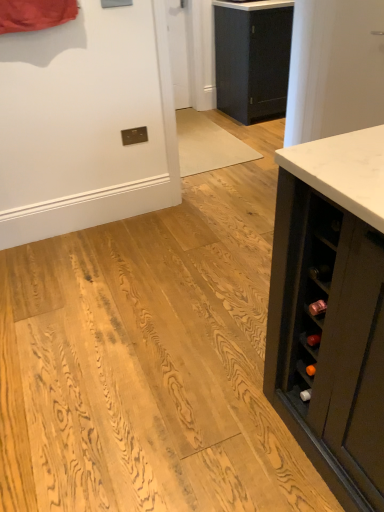
Question: Is matte black cabinet at center in front of or behind white marble countertop at upper center in the image?

Choices:
 (A) front
 (B) behind

Answer: (B)

Question: In the image, is matte black cabinet at center on the left side or the right side of white marble countertop at upper center?

Choices:
 (A) right
 (B) left

Answer: (A)

Question: Considering the positions of point (241, 54) and point (251, 8), is point (241, 54) closer or farther from the camera than point (251, 8)?

Choices:
 (A) closer
 (B) farther

Answer: (B)

Question: From a real-world perspective, is white marble countertop at upper center physically located above or below matte black cabinet at center?

Choices:
 (A) above
 (B) below

Answer: (A)

Question: In terms of height, does white marble countertop at upper center look taller or shorter compared to matte black cabinet at center?

Choices:
 (A) tall
 (B) short

Answer: (B)

Question: Would you say white marble countertop at upper center is inside or outside matte black cabinet at center?

Choices:
 (A) outside
 (B) inside

Answer: (A)

Question: In the image, is white marble countertop at upper center on the left side or the right side of matte black cabinet at center?

Choices:
 (A) right
 (B) left

Answer: (B)